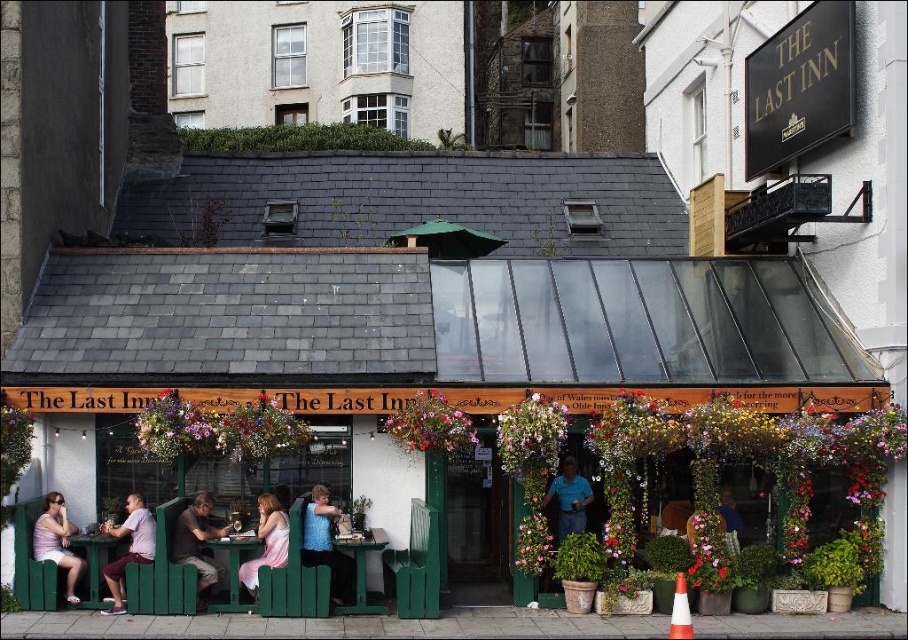
Does blue sleeveless top at center appear on the right side of green wooden table at center?

Indeed, blue sleeveless top at center is positioned on the right side of green wooden table at center.

Can you confirm if blue sleeveless top at center is taller than green wooden table at center?

Correct, blue sleeveless top at center is much taller as green wooden table at center.

Is point (326, 492) more distant than point (235, 548)?

Yes, it is behind point (235, 548).

Find the location of a particular element. Image resolution: width=908 pixels, height=640 pixels. blue sleeveless top at center is located at coordinates (326, 545).

Who is positioned more to the right, blue sleeveless top at center or matte pink shirt at lower left?

blue sleeveless top at center is more to the right.

Between blue sleeveless top at center and matte pink shirt at lower left, which one is positioned lower?

matte pink shirt at lower left is lower down.

Is point (326, 513) positioned before point (55, 564)?

No, (326, 513) is behind (55, 564).

You are a GUI agent. You are given a task and a screenshot of the screen. Output one action in this format:
    pyautogui.click(x=<x>, y=<y>)
    Task: Click on the blue sleeveless top at center
    
    Given the screenshot: What is the action you would take?
    pyautogui.click(x=326, y=545)

Who is more distant from viewer, (191, 531) or (87, 608)?

The point (191, 531) is behind.

You are a GUI agent. You are given a task and a screenshot of the screen. Output one action in this format:
    pyautogui.click(x=<x>, y=<y>)
    Task: Click on the dark brown leather jacket at center
    The image size is (908, 640).
    Given the screenshot: What is the action you would take?
    pyautogui.click(x=196, y=541)